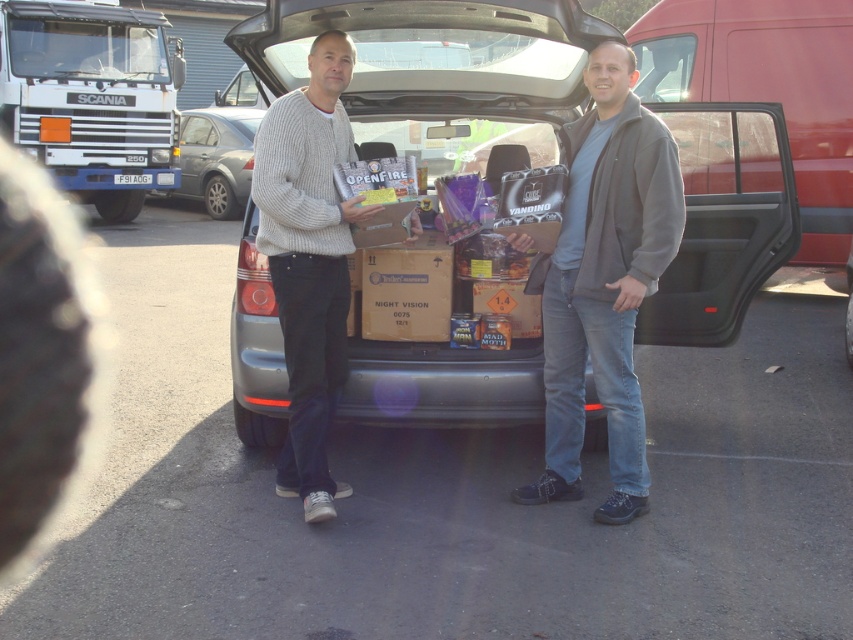
Consider the image. You are a delivery person who needs to unload the brown cardboard box at center from the metallic silver sedan at center. Can you lift the box directly from the trunk without moving any other items?

The brown cardboard box at center is positioned under the metallic silver sedan at center, so you cannot lift it directly without moving other items that are on top of it.

You are a delivery person who needs to load a package onto the vehicle that is higher up. Which vehicle should you choose between the white matte truck at upper left and the metallic silver sedan at center?

The white matte truck at upper left is located above the metallic silver sedan at center, so you should choose the white matte truck at upper left to load the package since it is higher up.